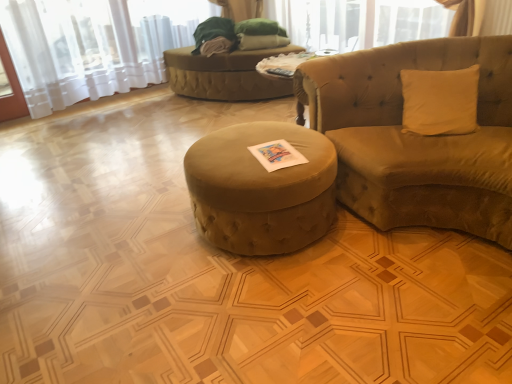
Question: Is velvet green ottoman at center to the left or to the right of velvet beige studio couch at right in the image?

Choices:
 (A) right
 (B) left

Answer: (B)

Question: Is velvet green ottoman at center wider or thinner than velvet beige studio couch at right?

Choices:
 (A) wide
 (B) thin

Answer: (B)

Question: Which is nearer to the velvet green bean bag at center?

Choices:
 (A) white sheer curtain at upper left
 (B) velvet beige studio couch at right
 (C) velvet green ottoman at center

Answer: (A)

Question: Estimate the real-world distances between objects in this image. Which object is closer to the velvet green ottoman at center?

Choices:
 (A) velvet beige studio couch at right
 (B) white sheer curtain at upper left
 (C) velvet green bean bag at center

Answer: (A)